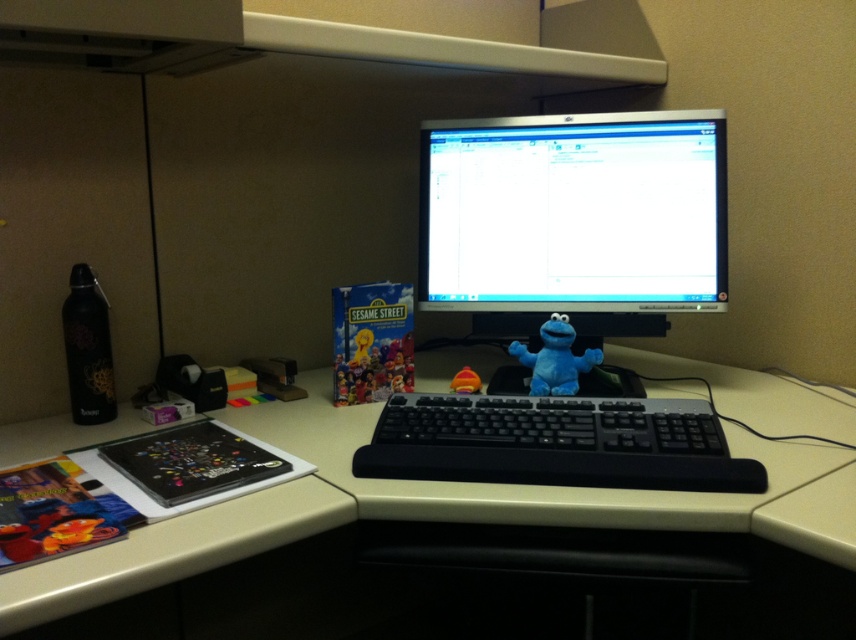
Question: Does beige plastic computer desk at center have a smaller size compared to matte black monitor at center?

Choices:
 (A) yes
 (B) no

Answer: (B)

Question: Estimate the real-world distances between objects in this image. Which object is closer to the black plastic keyboard at center?

Choices:
 (A) matte black monitor at center
 (B) beige plastic computer desk at center

Answer: (B)

Question: Is matte black monitor at center to the right of matte blue plush at center from the viewer's perspective?

Choices:
 (A) no
 (B) yes

Answer: (B)

Question: Based on their relative distances, which object is nearer to the black plastic keyboard at center?

Choices:
 (A) matte orange toy at center
 (B) matte black monitor at center

Answer: (A)

Question: Which point appears farthest from the camera in this image?

Choices:
 (A) (397, 488)
 (B) (572, 362)

Answer: (B)

Question: Does black plastic keyboard at center have a larger size compared to matte orange toy at center?

Choices:
 (A) no
 (B) yes

Answer: (B)